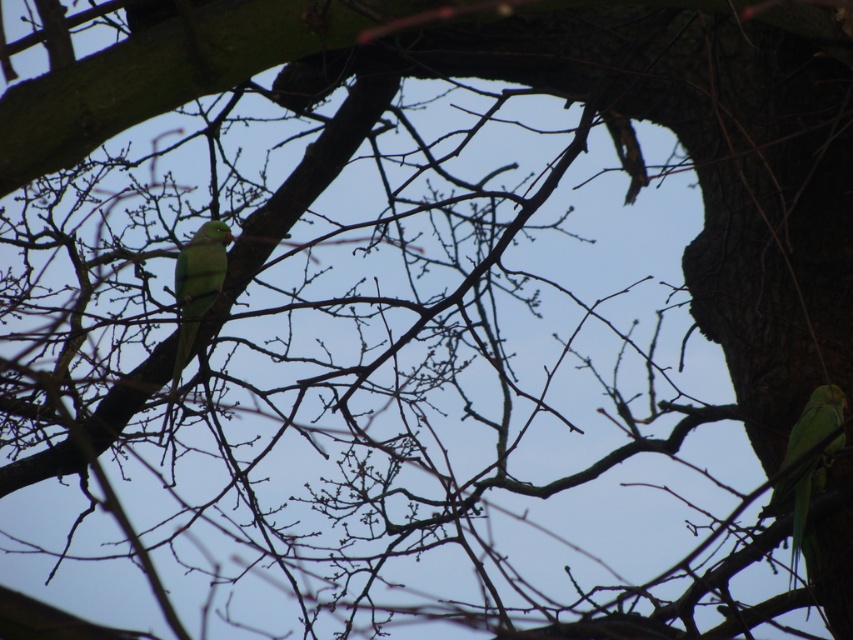
You are a birdwatcher trying to capture both parrots in a photo. The camera can only focus on objects within a 15 cm width. Given that the green matte parrot at right might be wider than green matte parrot at center, which parrot should you prioritize to ensure it fits within the camera frame?

The green matte parrot at right might be wider than green matte parrot at center, so you should prioritize capturing the green matte parrot at center first since it is narrower and more likely to fit within the camera frame.

From the picture: You are a birdwatcher observing two green matte parrots in a tree. You notice the green matte parrot at right and the green matte parrot at center. Which parrot is shorter in height?

The green matte parrot at right has a lesser height compared to the green matte parrot at center, so the green matte parrot at right is shorter.

You are a birdwatcher observing two green parakeets in a tree. You notice a point marked at coordinates (801, 490). Which object does this point correspond to?

The point at coordinates (801, 490) corresponds to the green matte parrot at right.